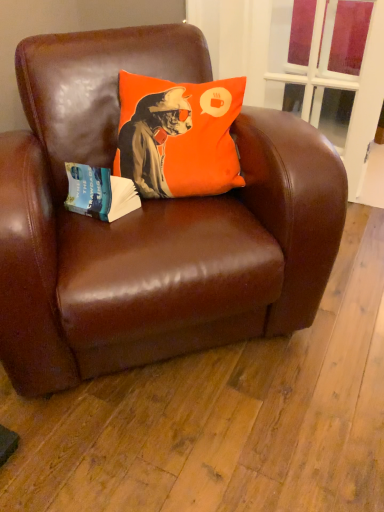
The image size is (384, 512). What do you see at coordinates (99, 193) in the screenshot? I see `blue paper at left` at bounding box center [99, 193].

Image resolution: width=384 pixels, height=512 pixels. Describe the element at coordinates (327, 54) in the screenshot. I see `transparent glass window at upper center` at that location.

Find the location of a particular element. The height and width of the screenshot is (512, 384). blue paper at left is located at coordinates (99, 193).

Does point (77, 170) appear closer or farther from the camera than point (154, 144)?

Point (77, 170) appears to be closer to the viewer than point (154, 144).

Considering their positions, is blue paper at left located in front of or behind orange fabric pillow at upper center?

Visually, blue paper at left is located behind orange fabric pillow at upper center.

Would you say blue paper at left is inside or outside orange fabric pillow at upper center?

blue paper at left is spatially situated outside orange fabric pillow at upper center.

Considering the sizes of objects blue paper at left and orange fabric pillow at upper center in the image provided, who is wider, blue paper at left or orange fabric pillow at upper center?

With larger width is orange fabric pillow at upper center.

From a real-world perspective, is blue paper at left positioned over brown leather chair at center based on gravity?

Correct, in the physical world, blue paper at left is higher than brown leather chair at center.

In the scene shown: What's the angular difference between blue paper at left and brown leather chair at center's facing directions?

They differ by 32.1 degrees in their facing directions.

In terms of width, does blue paper at left look wider or thinner when compared to brown leather chair at center?

In the image, blue paper at left appears to be more narrow than brown leather chair at center.

What's the angular difference between orange fabric pillow at upper center and transparent glass window at upper center's facing directions?

The angular difference between orange fabric pillow at upper center and transparent glass window at upper center is 13.9 degrees.

Consider the image. How distant is orange fabric pillow at upper center from transparent glass window at upper center?

orange fabric pillow at upper center is 35.03 inches away from transparent glass window at upper center.

Which is in front, orange fabric pillow at upper center or transparent glass window at upper center?

orange fabric pillow at upper center is closer to the camera.

Locate an element on the screen. pillow above the transparent glass window at upper center (from a real-world perspective) is located at coordinates coord(178,136).

Can you confirm if blue paper at left is thinner than transparent glass window at upper center?

In fact, blue paper at left might be wider than transparent glass window at upper center.

Does blue paper at left turn towards transparent glass window at upper center?

No, blue paper at left is not oriented towards transparent glass window at upper center.

In terms of size, does blue paper at left appear bigger or smaller than transparent glass window at upper center?

In the image, blue paper at left appears to be smaller than transparent glass window at upper center.

From a real-world perspective, is blue paper at left physically located above or below transparent glass window at upper center?

blue paper at left is situated higher than transparent glass window at upper center in the real world.

From a real-world perspective, who is located lower, transparent glass window at upper center or brown leather chair at center?

From a 3D spatial view, brown leather chair at center is below.

Based on the photo, is brown leather chair at center a part of transparent glass window at upper center?

No.

Considering the relative sizes of transparent glass window at upper center and brown leather chair at center in the image provided, is transparent glass window at upper center taller than brown leather chair at center?

Correct, transparent glass window at upper center is much taller as brown leather chair at center.

In order to click on window screen above the brown leather chair at center (from the image's perspective) in this screenshot , I will do `click(327, 54)`.

Do you think transparent glass window at upper center is within orange fabric pillow at upper center, or outside of it?

transparent glass window at upper center is not enclosed by orange fabric pillow at upper center.

Is point (351, 48) positioned behind point (199, 109)?

Yes, point (351, 48) is farther from viewer.

Which of these two, transparent glass window at upper center or orange fabric pillow at upper center, is thinner?

transparent glass window at upper center.

Does point (138, 90) come farther from viewer compared to point (160, 248)?

Yes, point (138, 90) is behind point (160, 248).

Is orange fabric pillow at upper center oriented towards brown leather chair at center?

Yes.

Can you confirm if orange fabric pillow at upper center is bigger than brown leather chair at center?

No.

From the image's perspective, is orange fabric pillow at upper center below brown leather chair at center?

No, from the image's perspective, orange fabric pillow at upper center is not beneath brown leather chair at center.

Where is `paperback book on the left of orange fabric pillow at upper center`? The height and width of the screenshot is (512, 384). paperback book on the left of orange fabric pillow at upper center is located at coordinates (99, 193).

Identify the location of chair located in front of the blue paper at left. This screenshot has width=384, height=512. (150, 222).

Looking at the image, which one is located closer to blue paper at left, brown leather chair at center or transparent glass window at upper center?

brown leather chair at center lies closer to blue paper at left than the other object.

When comparing their distances from orange fabric pillow at upper center, does blue paper at left or transparent glass window at upper center seem further?

transparent glass window at upper center is positioned further to the anchor orange fabric pillow at upper center.

Considering their positions, is transparent glass window at upper center positioned further to orange fabric pillow at upper center than brown leather chair at center?

transparent glass window at upper center.

Based on their spatial positions, is orange fabric pillow at upper center or blue paper at left further from brown leather chair at center?

blue paper at left is further to brown leather chair at center.

From the picture: Which object lies further to the anchor point brown leather chair at center, orange fabric pillow at upper center or transparent glass window at upper center?

transparent glass window at upper center is positioned further to the anchor brown leather chair at center.

When comparing their distances from orange fabric pillow at upper center, does blue paper at left or brown leather chair at center seem closer?

Among the two, blue paper at left is located nearer to orange fabric pillow at upper center.

Considering their positions, is transparent glass window at upper center positioned closer to blue paper at left than orange fabric pillow at upper center?

The object closer to blue paper at left is orange fabric pillow at upper center.

Looking at the image, which one is located closer to blue paper at left, brown leather chair at center or orange fabric pillow at upper center?

Among the two, orange fabric pillow at upper center is located nearer to blue paper at left.

Find the location of a particular element. The width and height of the screenshot is (384, 512). pillow between blue paper at left and transparent glass window at upper center from left to right is located at coordinates (178, 136).

Locate an element on the screen. This screenshot has width=384, height=512. pillow between brown leather chair at center and blue paper at left in the front-back direction is located at coordinates (178, 136).

Image resolution: width=384 pixels, height=512 pixels. I want to click on pillow between brown leather chair at center and transparent glass window at upper center in the front-back direction, so click(x=178, y=136).

Where is `paperback book between brown leather chair at center and transparent glass window at upper center in the front-back direction`? Image resolution: width=384 pixels, height=512 pixels. paperback book between brown leather chair at center and transparent glass window at upper center in the front-back direction is located at coordinates (99, 193).